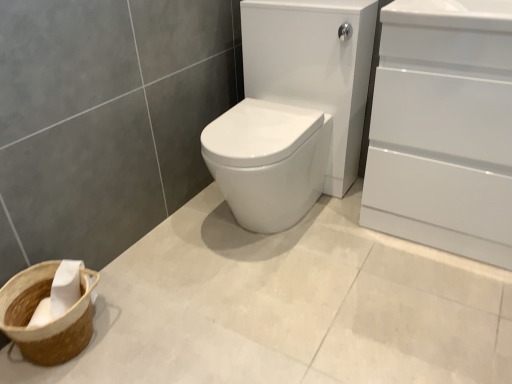
Question: From the image's perspective, is white glossy sink at center located beneath brown woven basket at lower left?

Choices:
 (A) no
 (B) yes

Answer: (A)

Question: Could brown woven basket at lower left be considered to be inside white glossy sink at center?

Choices:
 (A) no
 (B) yes

Answer: (A)

Question: Considering the relative sizes of white glossy sink at center and brown woven basket at lower left in the image provided, is white glossy sink at center wider than brown woven basket at lower left?

Choices:
 (A) no
 (B) yes

Answer: (B)

Question: Is white glossy sink at center to the left of brown woven basket at lower left from the viewer's perspective?

Choices:
 (A) yes
 (B) no

Answer: (B)

Question: Is white glossy sink at center at the right side of brown woven basket at lower left?

Choices:
 (A) yes
 (B) no

Answer: (A)

Question: Would you say white glossy sink at center is a long distance from brown woven basket at lower left?

Choices:
 (A) no
 (B) yes

Answer: (A)

Question: Considering the relative sizes of brown woven basket at lower left and white glossy sink at center in the image provided, is brown woven basket at lower left bigger than white glossy sink at center?

Choices:
 (A) yes
 (B) no

Answer: (B)

Question: Is brown woven basket at lower left thinner than white glossy sink at center?

Choices:
 (A) yes
 (B) no

Answer: (A)

Question: Is brown woven basket at lower left to the right of white glossy sink at center from the viewer's perspective?

Choices:
 (A) no
 (B) yes

Answer: (A)

Question: Can you see brown woven basket at lower left touching white glossy sink at center?

Choices:
 (A) yes
 (B) no

Answer: (B)

Question: Is brown woven basket at lower left not near white glossy sink at center?

Choices:
 (A) yes
 (B) no

Answer: (B)

Question: Is brown woven basket at lower left looking in the opposite direction of white glossy sink at center?

Choices:
 (A) yes
 (B) no

Answer: (B)

Question: Is white glossy sink at center shorter than white glossy cabinet at right?

Choices:
 (A) yes
 (B) no

Answer: (A)